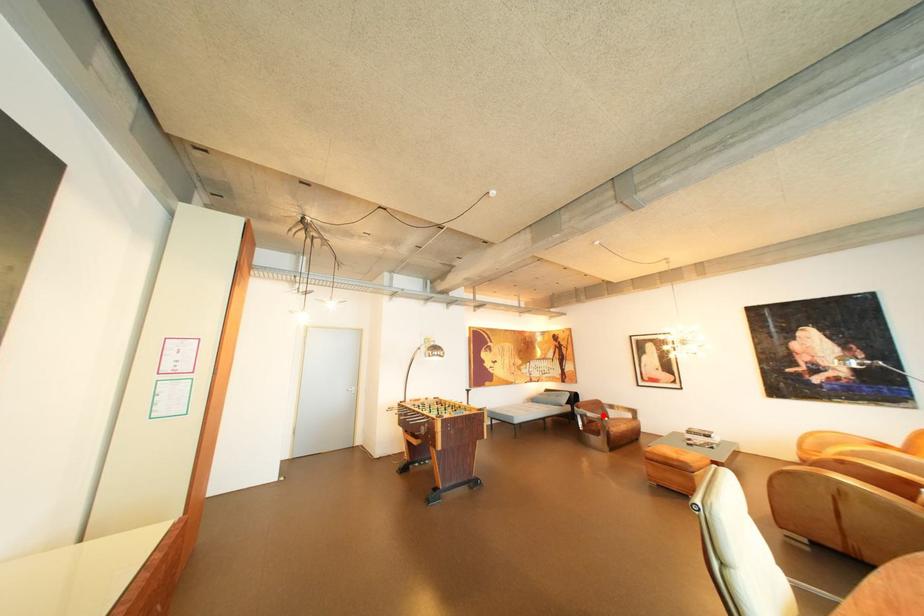
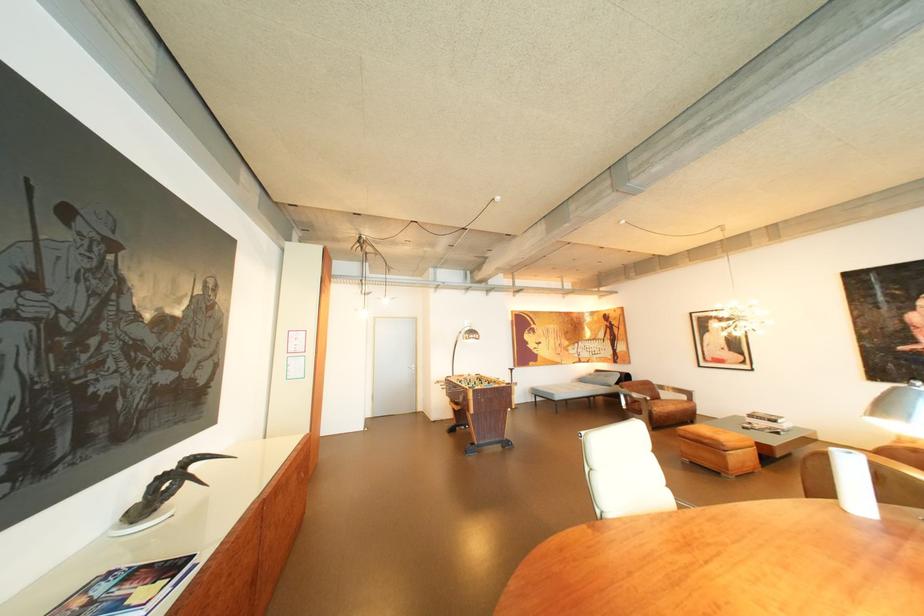
Question: I am providing you with two images of the same scene from different viewpoints. Image1 has a red point marked. In image2, the corresponding 3D location appears at what relative position? Reply with the corresponding letter.

Choices:
 (A) Closer
 (B) Farther

Answer: (A)